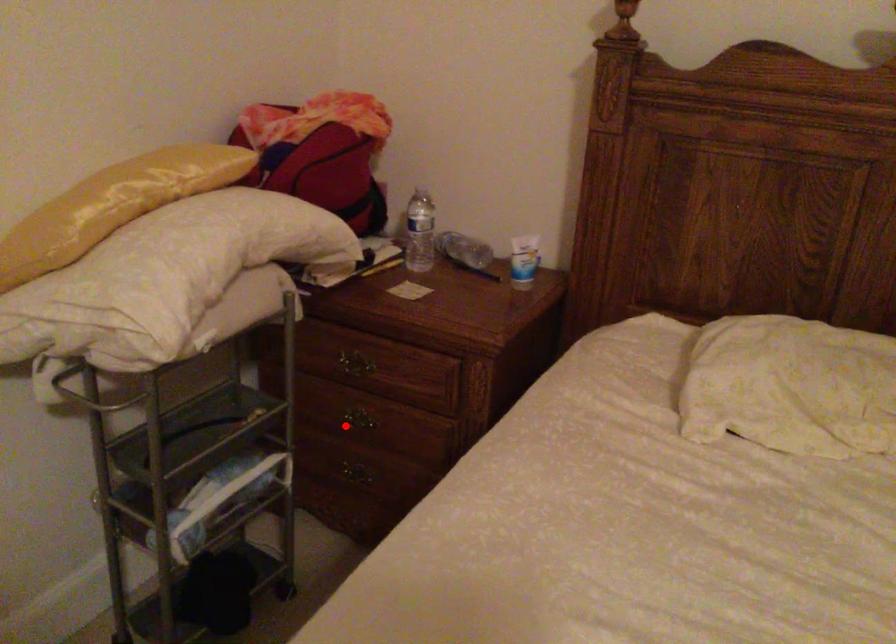
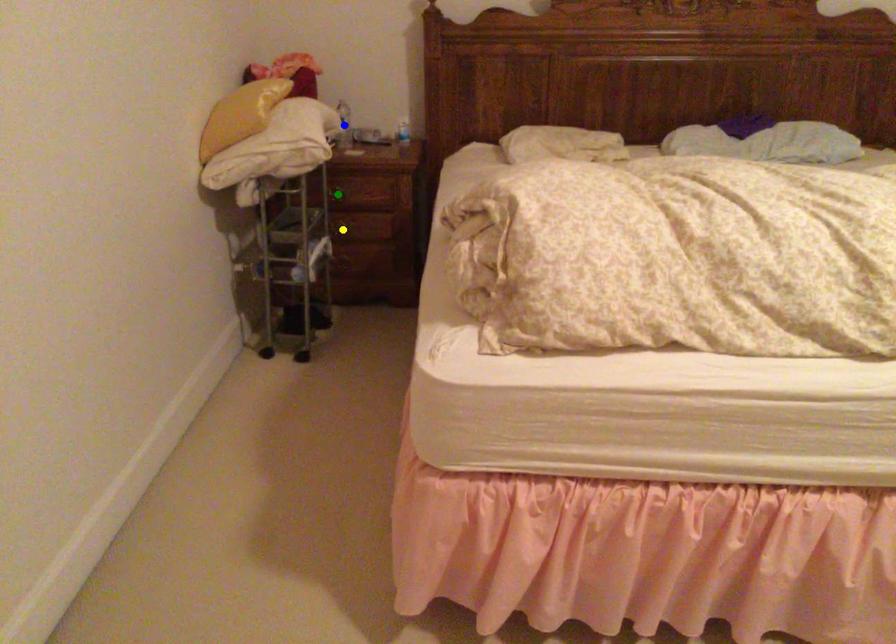
Question: I am providing you with two images of the same scene from different viewpoints. A red point is marked on the first image. You are given multiple points on the second image. Which spot in image 2 lines up with the point in image 1?

Choices:
 (A) blue point
 (B) yellow point
 (C) green point

Answer: (B)